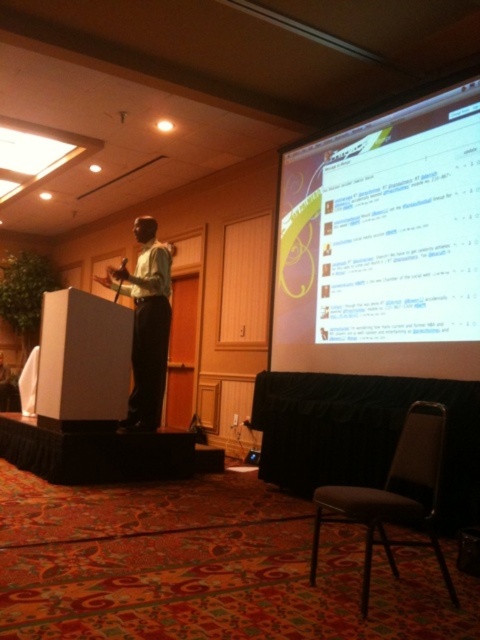
Does white glossy projection screen at upper right appear on the right side of gray fabric chair at lower right?

In fact, white glossy projection screen at upper right is to the left of gray fabric chair at lower right.

Between white glossy projection screen at upper right and gray fabric chair at lower right, which one has more height?

white glossy projection screen at upper right is taller.

This screenshot has height=640, width=480. What do you see at coordinates (372, 244) in the screenshot?
I see `white glossy projection screen at upper right` at bounding box center [372, 244].

At what (x,y) coordinates should I click in order to perform the action: click on white glossy projection screen at upper right. Please return your answer as a coordinate pair (x, y). Looking at the image, I should click on (372, 244).

Which is more to the left, white glossy projection screen at upper right or matte green shirt at center?

From the viewer's perspective, matte green shirt at center appears more on the left side.

Which is more to the right, white glossy projection screen at upper right or matte green shirt at center?

white glossy projection screen at upper right

Is point (437, 134) positioned in front of point (147, 244)?

Yes.

This screenshot has width=480, height=640. I want to click on white glossy projection screen at upper right, so click(372, 244).

Between gray fabric chair at lower right and matte green shirt at center, which one has more height?

matte green shirt at center is taller.

Between gray fabric chair at lower right and matte green shirt at center, which one is positioned lower?

gray fabric chair at lower right is below.

Based on the photo, who is more forward, (409, 428) or (132, 227)?

Point (409, 428) is in front.

The image size is (480, 640). Identify the location of gray fabric chair at lower right. (394, 496).